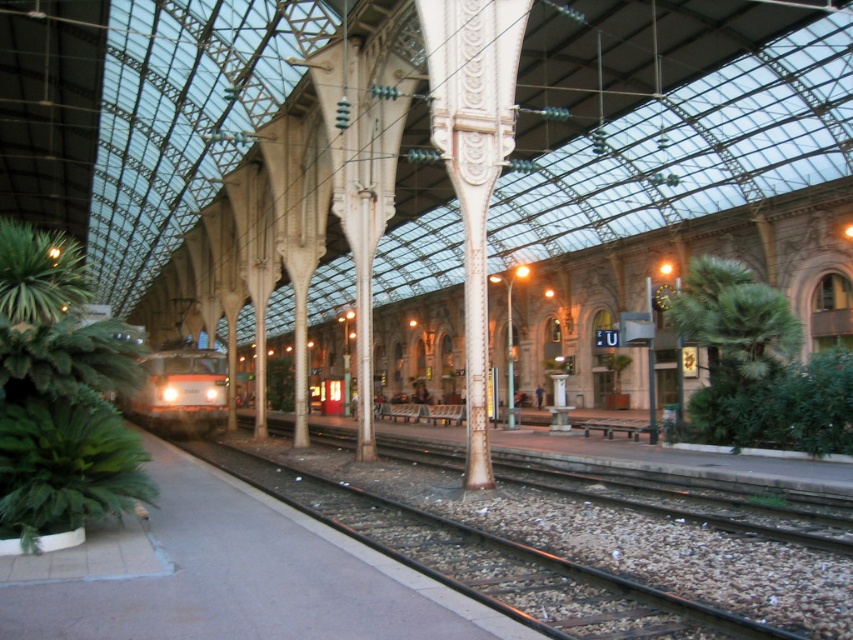
Question: Among these objects, which one is farthest from the camera?

Choices:
 (A) green leafy plant at right
 (B) green leafy plant at lower left
 (C) metal/smooth track at center
 (D) green leafy plant at left

Answer: (A)

Question: Is metal/smooth track at center smaller than green leafy plant at left?

Choices:
 (A) yes
 (B) no

Answer: (A)

Question: In this image, where is metal/smooth track at center located relative to orange metallic train at center?

Choices:
 (A) left
 (B) right

Answer: (B)

Question: Considering the real-world distances, which object is closest to the metal/smooth track at center?

Choices:
 (A) green leafy plant at left
 (B) green leafy plant at right
 (C) green leafy plant at lower left
 (D) orange metallic train at center

Answer: (C)

Question: Can you confirm if green leafy plant at left is bigger than green leafy plant at lower left?

Choices:
 (A) yes
 (B) no

Answer: (A)

Question: Estimate the real-world distances between objects in this image. Which object is closer to the green leafy plant at right?

Choices:
 (A) orange metallic train at center
 (B) green leafy plant at left
 (C) metal/smooth track at center
 (D) green leafy plant at lower left

Answer: (C)